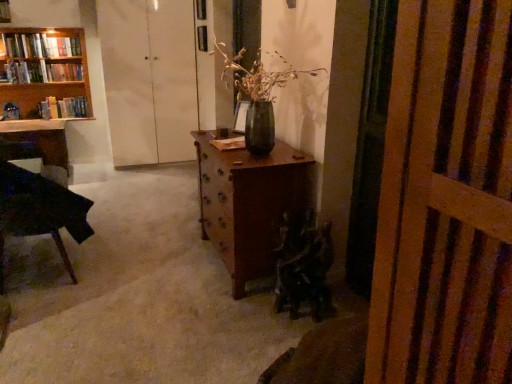
Question: Looking at the image, does hardcover book at left, acting as the 1th book starting from the bottom, seem bigger or smaller compared to wooden bookshelf at upper left, arranged as the third book when viewed from the top?

Choices:
 (A) small
 (B) big

Answer: (A)

Question: Is hardcover book at left, acting as the 1th book starting from the bottom, in front of or behind wooden bookshelf at upper left, arranged as the third book when viewed from the top, in the image?

Choices:
 (A) front
 (B) behind

Answer: (B)

Question: Which object is positioned farthest from the dark green fabric armchair at lower center?

Choices:
 (A) hardcover book at upper left, which is counted as the 2th book, starting from the top
 (B) hardcover book at upper left, which ranks as the 1th book in top-to-bottom order
 (C) matte black desk at left
 (D) wooden bookshelf at upper left, arranged as the third book when viewed from the top
 (E) brown wood table at center

Answer: (B)

Question: Considering the real-world distances, which object is closest to the hardcover book at upper left, the 4th book when ordered from bottom to top?

Choices:
 (A) dark wood chair at left
 (B) wooden bookshelf at left
 (C) matte dark green vase at center
 (D) white matte cabinet at upper center
 (E) hardcover book at upper left, the third book in the bottom-to-top sequence

Answer: (E)